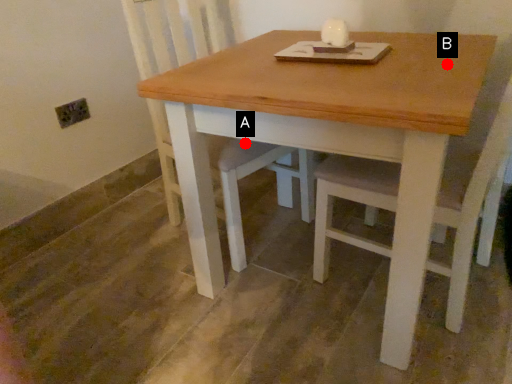
Question: Two points are circled on the image, labeled by A and B beside each circle. Which point is closer to the camera?

Choices:
 (A) A is closer
 (B) B is closer

Answer: (B)